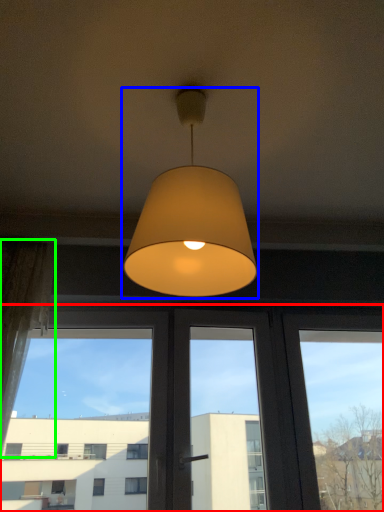
Question: Considering the real-world distances, which object is farthest from window (highlighted by a red box)? lamp (highlighted by a blue box) or curtain (highlighted by a green box)?

Choices:
 (A) lamp
 (B) curtain

Answer: (A)